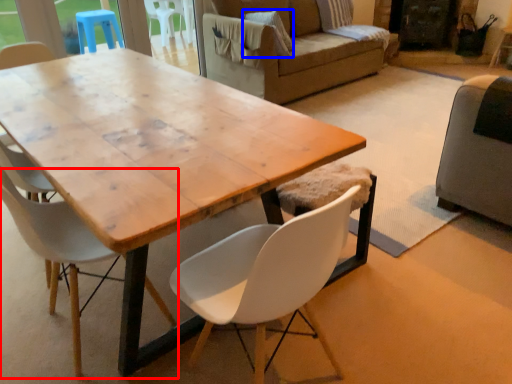
Question: Which of the following is the closest to the observer, chair (highlighted by a red box) or pillow (highlighted by a blue box)?

Choices:
 (A) chair
 (B) pillow

Answer: (A)